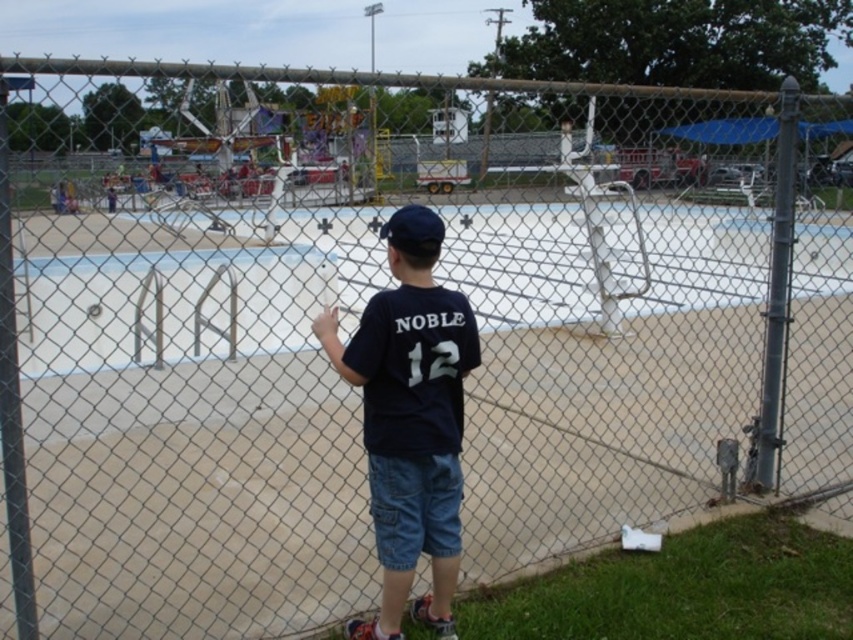
Is dark blue t-shirt at center shorter than black fabric baseball cap at center?

In fact, dark blue t-shirt at center may be taller than black fabric baseball cap at center.

Is point (440, 476) less distant than point (405, 230)?

No, it is not.

Identify the location of dark blue t-shirt at center. This screenshot has height=640, width=853. (410, 419).